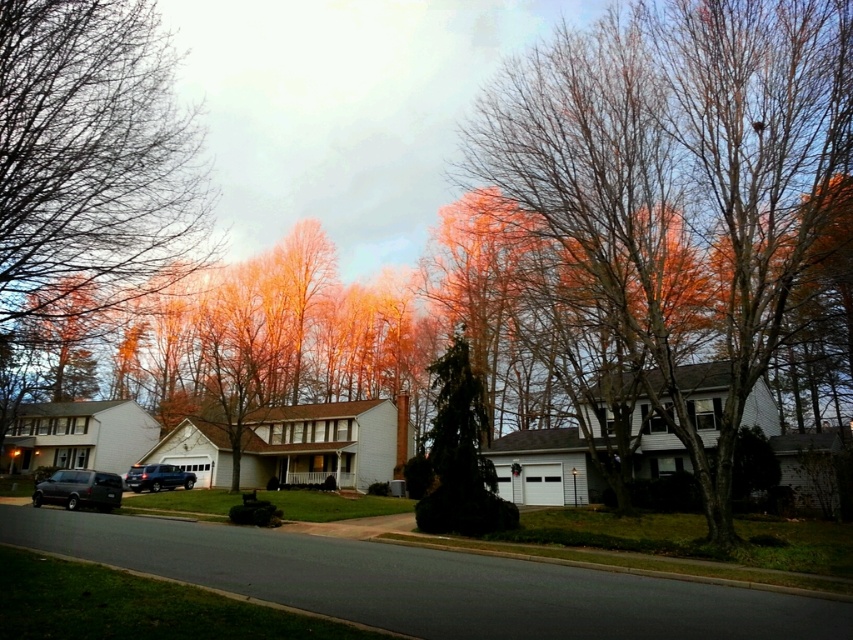
You are planning to park your new car, which is as wide as the matte black van at lower left, in front of the green textured evergreen tree at center. Will the tree be able to fit between your car and the sidewalk?

The green textured evergreen tree at center is narrower than the matte black van at lower left, so if your car is as wide as the van, there might not be enough space for the tree between the car and the sidewalk. You should consider parking further away to avoid damaging the tree.

You are a delivery driver who needs to park your matte black van at lower left without blocking the driveway of the house behind the green textured evergreen tree at center. Based on the scene, can you park the van there?

The green textured evergreen tree at center is located above the matte black van at lower left, meaning the tree is between the van and the house driveway. Therefore, parking the matte black van at lower left would not block the driveway since the tree is in front of the van.